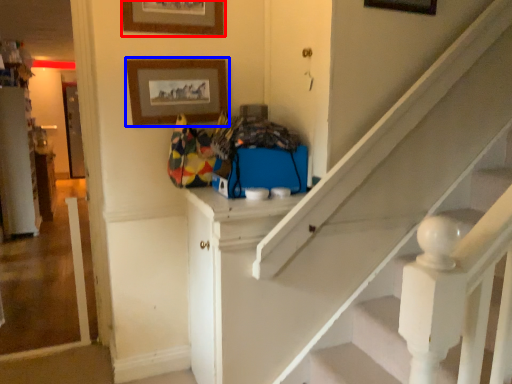
Question: Which object is closer to the camera taking this photo, picture frame (highlighted by a red box) or picture frame (highlighted by a blue box)?

Choices:
 (A) picture frame
 (B) picture frame

Answer: (A)